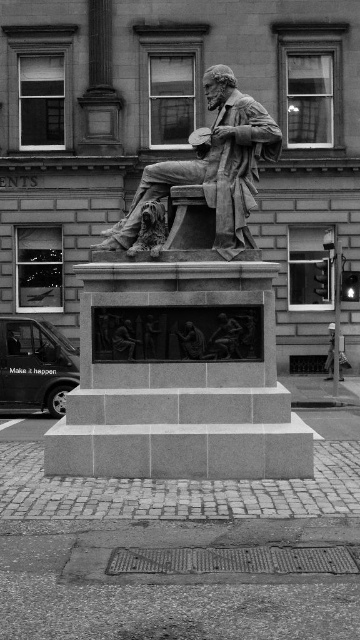
You are standing in front of the statue and want to take a photo of it with your camera. If your camera has a maximum focus distance of 30 feet, will you be able to capture the bronze statue at center clearly?

The bronze statue at center and camera are 29.74 feet apart. Since 29.74 feet is less than 30 feet, the camera can focus on the bronze statue at center clearly.